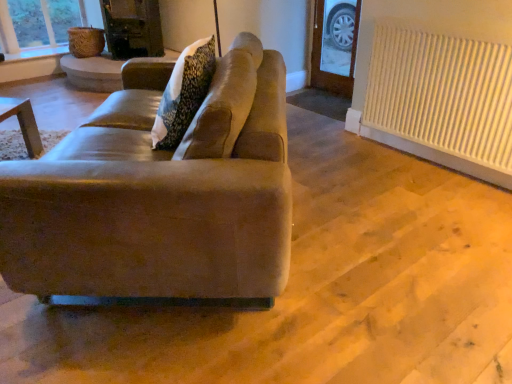
Locate an element on the screen. white ribbed radiator at right is located at coordinates (442, 94).

What do you see at coordinates (442, 94) in the screenshot? The image size is (512, 384). I see `white ribbed radiator at right` at bounding box center [442, 94].

Identify the location of suede-like beige couch at center. (160, 194).

What do you see at coordinates (160, 194) in the screenshot?
I see `suede-like beige couch at center` at bounding box center [160, 194].

Where is `white ribbed radiator at right`? This screenshot has width=512, height=384. white ribbed radiator at right is located at coordinates (442, 94).

Does white ribbed radiator at right appear on the left side of suede-like beige couch at center?

No.

Who is more distant, white ribbed radiator at right or suede-like beige couch at center?

white ribbed radiator at right.

Between point (486, 139) and point (170, 240), which one is positioned behind?

The point (486, 139) is farther.

From the image's perspective, which is above, white ribbed radiator at right or suede-like beige couch at center?

white ribbed radiator at right is shown above in the image.

From a real-world perspective, is white ribbed radiator at right physically above suede-like beige couch at center?

No, from a real-world perspective, white ribbed radiator at right is not over suede-like beige couch at center

Is white ribbed radiator at right thinner than suede-like beige couch at center?

Indeed, white ribbed radiator at right has a lesser width compared to suede-like beige couch at center.

Considering the relative sizes of white ribbed radiator at right and suede-like beige couch at center in the image provided, is white ribbed radiator at right shorter than suede-like beige couch at center?

In fact, white ribbed radiator at right may be taller than suede-like beige couch at center.

Considering the sizes of objects white ribbed radiator at right and suede-like beige couch at center in the image provided, who is smaller, white ribbed radiator at right or suede-like beige couch at center?

Smaller between the two is white ribbed radiator at right.

Is white ribbed radiator at right positioned beyond the bounds of suede-like beige couch at center?

Yes, white ribbed radiator at right is located beyond the bounds of suede-like beige couch at center.

Would you say white ribbed radiator at right is a long distance from suede-like beige couch at center?

Yes, white ribbed radiator at right and suede-like beige couch at center are located far from each other.

Is white ribbed radiator at right looking in the opposite direction of suede-like beige couch at center?

No.

Find the location of a particular element. This screenshot has width=512, height=384. radiator directly beneath the suede-like beige couch at center (from a real-world perspective) is located at coordinates tap(442, 94).

In the image, is suede-like beige couch at center on the left side or the right side of white ribbed radiator at right?

In the image, suede-like beige couch at center appears on the left side of white ribbed radiator at right.

Looking at this image, does suede-like beige couch at center come in front of white ribbed radiator at right?

Yes, suede-like beige couch at center is closer to the camera.

Is point (288, 176) closer to camera compared to point (474, 151)?

That is True.

Looking at this image, from the image's perspective, which is above, suede-like beige couch at center or white ribbed radiator at right?

From the image's view, white ribbed radiator at right is above.

In the scene shown: From a real-world perspective, which object rests below the other?

In real-world perspective, white ribbed radiator at right is lower.

Between suede-like beige couch at center and white ribbed radiator at right, which one has larger width?

Wider between the two is suede-like beige couch at center.

Consider the image. Does suede-like beige couch at center have a greater height compared to white ribbed radiator at right?

Incorrect, the height of suede-like beige couch at center is not larger of that of white ribbed radiator at right.

Considering the relative sizes of suede-like beige couch at center and white ribbed radiator at right in the image provided, is suede-like beige couch at center bigger than white ribbed radiator at right?

Yes.

Which is correct: suede-like beige couch at center is inside white ribbed radiator at right, or outside of it?

suede-like beige couch at center is located beyond the bounds of white ribbed radiator at right.

Is suede-like beige couch at center in contact with white ribbed radiator at right?

suede-like beige couch at center and white ribbed radiator at right are not in contact.

Could you tell me if suede-like beige couch at center is facing white ribbed radiator at right?

No, suede-like beige couch at center is not aimed at white ribbed radiator at right.

How different are the orientations of suede-like beige couch at center and white ribbed radiator at right in degrees?

The facing directions of suede-like beige couch at center and white ribbed radiator at right are 42.3 degrees apart.

Based on the photo, measure the distance from suede-like beige couch at center to white ribbed radiator at right.

1.40 meters.

What are the coordinates of `radiator on the right side of suede-like beige couch at center` in the screenshot? It's located at (442, 94).

Find the location of a particular element. The width and height of the screenshot is (512, 384). studio couch in front of the white ribbed radiator at right is located at coordinates (x=160, y=194).

The width and height of the screenshot is (512, 384). In order to click on radiator behind the suede-like beige couch at center in this screenshot , I will do `click(442, 94)`.